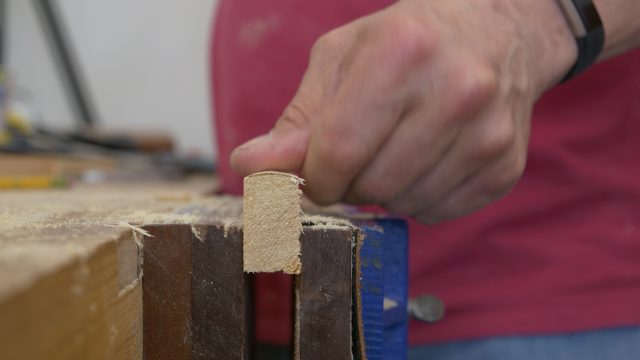
Locate an element on the screen. grey wall behind wooden bench is located at coordinates (141, 72).